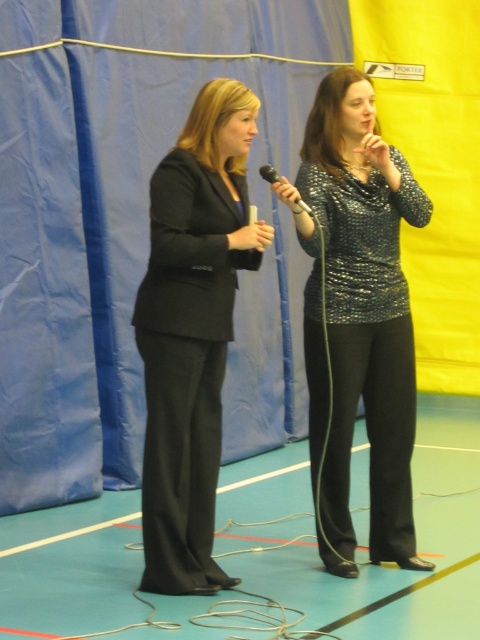
Question: Does sparkly silver blouse at center appear on the right side of black matte suit at center?

Choices:
 (A) yes
 (B) no

Answer: (A)

Question: Among these objects, which one is farthest from the camera?

Choices:
 (A) black matte suit at center
 (B) sparkly silver blouse at center

Answer: (B)

Question: Where is black matte suit at center located in relation to black metallic microphone at center in the image?

Choices:
 (A) left
 (B) right

Answer: (A)

Question: Which point appears farthest from the camera in this image?

Choices:
 (A) (204, 308)
 (B) (314, 97)
 (C) (272, 173)

Answer: (B)

Question: Is sparkly silver blouse at center further to the viewer compared to black matte suit at center?

Choices:
 (A) no
 (B) yes

Answer: (B)

Question: Which point appears farthest from the camera in this image?

Choices:
 (A) (308, 205)
 (B) (273, 188)
 (C) (168, 564)

Answer: (A)